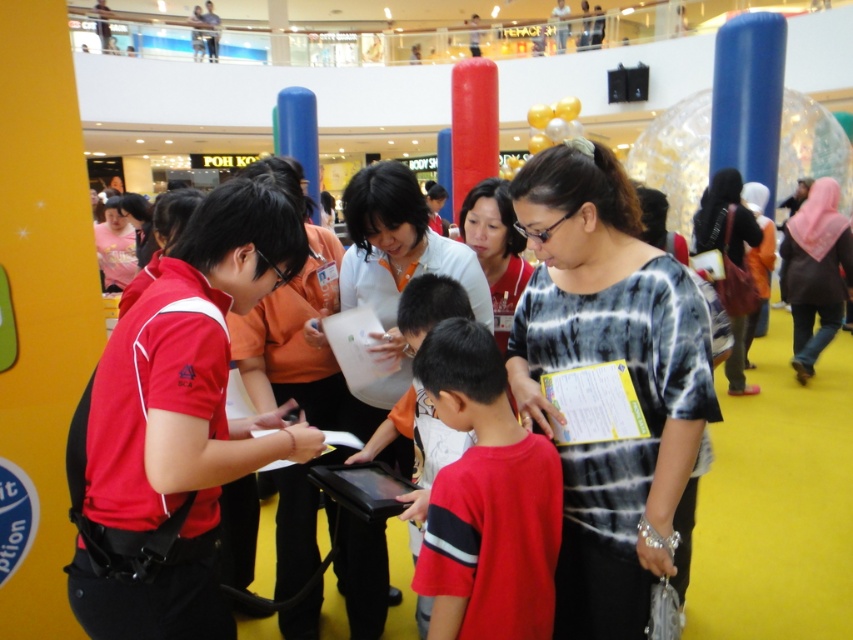
Question: Among these points, which one is farthest from the camera?

Choices:
 (A) (526, 304)
 (B) (744, 262)
 (C) (367, 195)
 (D) (538, 518)

Answer: (B)

Question: Observing the image, what is the correct spatial positioning of pink fabric hijab at right in reference to matte black shirt at right?

Choices:
 (A) left
 (B) right

Answer: (B)

Question: Based on their relative distances, which object is nearer to the red cotton shirt at center?

Choices:
 (A) pink fabric hijab at right
 (B) black tie-dye shirt at center
 (C) matte black shirt at right

Answer: (B)

Question: In this image, where is pink fabric hijab at right located relative to matte white blouse at center?

Choices:
 (A) right
 (B) left

Answer: (A)

Question: Which of the following is the farthest from the observer?

Choices:
 (A) matte black shirt at right
 (B) black tie-dye shirt at center

Answer: (A)

Question: Does black tie-dye shirt at center appear over white matte shirt at center?

Choices:
 (A) no
 (B) yes

Answer: (A)